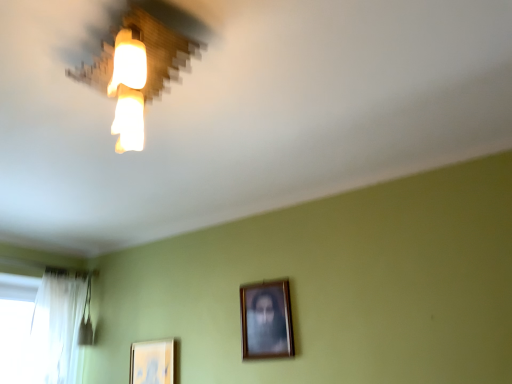
Where is `wooden framed portrait at center, the 1th picture frame when ordered from right to left`? This screenshot has height=384, width=512. wooden framed portrait at center, the 1th picture frame when ordered from right to left is located at coordinates (266, 320).

What do you see at coordinates (152, 362) in the screenshot? Image resolution: width=512 pixels, height=384 pixels. I see `matte white picture frame at lower left, placed as the second picture frame when sorted from top to bottom` at bounding box center [152, 362].

At what (x,y) coordinates should I click in order to perform the action: click on wooden framed portrait at center, the 2th picture frame positioned from the back. Please return your answer as a coordinate pair (x, y). This screenshot has height=384, width=512. Looking at the image, I should click on (266, 320).

Who is more distant, wooden framed portrait at center, the 2th picture frame viewed from the left, or white sheer curtain at left?

white sheer curtain at left is further from the camera.

Is point (280, 324) less distant than point (12, 283)?

Yes.

The image size is (512, 384). What are the coordinates of `window that is above the wooden framed portrait at center, the 2th picture frame viewed from the left (from a real-world perspective)` in the screenshot? It's located at click(42, 326).

Who is taller, white sheer curtain at left or wooden lampshade at upper left?

With more height is white sheer curtain at left.

Considering the relative positions of white sheer curtain at left and wooden lampshade at upper left in the image provided, is white sheer curtain at left in front of wooden lampshade at upper left?

No, white sheer curtain at left is further to the viewer.

Looking at this image, does white sheer curtain at left contain wooden lampshade at upper left?

No.

Is white sheer curtain at left positioned with its back to wooden lampshade at upper left?

No.

Is point (82, 318) farther from camera compared to point (290, 315)?

Yes.

From the picture: Considering the relative sizes of white sheer curtain at left and wooden framed portrait at center, the 1th picture frame when ordered from right to left, in the image provided, is white sheer curtain at left taller than wooden framed portrait at center, the 1th picture frame when ordered from right to left,?

Indeed, white sheer curtain at left has a greater height compared to wooden framed portrait at center, the 1th picture frame when ordered from right to left.

Looking at this image, visually, is white sheer curtain at left positioned to the left or to the right of wooden framed portrait at center, the first picture frame positioned from the front?

In the image, white sheer curtain at left appears on the left side of wooden framed portrait at center, the first picture frame positioned from the front.

Is matte white picture frame at lower left, which appears as the first picture frame when viewed from the back, aimed at wooden lampshade at upper left?

No, matte white picture frame at lower left, which appears as the first picture frame when viewed from the back, is not facing towards wooden lampshade at upper left.

From the image's perspective, is matte white picture frame at lower left, which is the first picture frame from left to right, located above wooden lampshade at upper left?

Incorrect, from the image's perspective, matte white picture frame at lower left, which is the first picture frame from left to right, is lower than wooden lampshade at upper left.

Considering the points (162, 353) and (175, 56), which point is behind, point (162, 353) or point (175, 56)?

Positioned behind is point (162, 353).

Is wooden framed portrait at center, which is the 2th picture frame from bottom to top, at the left side of matte white picture frame at lower left, which is the second picture frame in front-to-back order?

Result: No, wooden framed portrait at center, which is the 2th picture frame from bottom to top, is not to the left of matte white picture frame at lower left, which is the second picture frame in front-to-back order.

Who is shorter, wooden framed portrait at center, the 2th picture frame viewed from the left, or matte white picture frame at lower left, which appears as the first picture frame when viewed from the back?

Standing shorter between the two is matte white picture frame at lower left, which appears as the first picture frame when viewed from the back.

Can you confirm if wooden framed portrait at center, which is the 2th picture frame from bottom to top, is thinner than matte white picture frame at lower left, arranged as the second picture frame when viewed from the right?

Indeed, wooden framed portrait at center, which is the 2th picture frame from bottom to top, has a lesser width compared to matte white picture frame at lower left, arranged as the second picture frame when viewed from the right.

Between wooden framed portrait at center, the 2th picture frame positioned from the back, and matte white picture frame at lower left, arranged as the second picture frame when viewed from the right, which one is positioned behind?

→ matte white picture frame at lower left, arranged as the second picture frame when viewed from the right, is further from the camera.

How far apart are wooden framed portrait at center, the 1th picture frame from the top, and wooden lampshade at upper left?

wooden framed portrait at center, the 1th picture frame from the top, is 1.36 meters from wooden lampshade at upper left.

Does wooden framed portrait at center, the first picture frame positioned from the front, come behind wooden lampshade at upper left?

Yes, wooden framed portrait at center, the first picture frame positioned from the front, is further from the camera.

Is wooden framed portrait at center, the 1th picture frame from the top, outside of wooden lampshade at upper left?

wooden framed portrait at center, the 1th picture frame from the top, is positioned outside wooden lampshade at upper left.

Which of these two, wooden framed portrait at center, the 1th picture frame when ordered from right to left, or wooden lampshade at upper left, stands taller?

wooden framed portrait at center, the 1th picture frame when ordered from right to left, is taller.

Is point (162, 375) more distant than point (4, 346)?

No, it is not.

Is the depth of matte white picture frame at lower left, positioned as the 1th picture frame in bottom-to-top order, greater than that of white sheer curtain at left?

That is False.

Is matte white picture frame at lower left, which is the second picture frame in front-to-back order, next to white sheer curtain at left and touching it?

No, matte white picture frame at lower left, which is the second picture frame in front-to-back order, is not in contact with white sheer curtain at left.

Is matte white picture frame at lower left, positioned as the 1th picture frame in bottom-to-top order, shorter than white sheer curtain at left?

Yes.

Locate an element on the screen. This screenshot has width=512, height=384. window located on the left of wooden framed portrait at center, the 1th picture frame from the top is located at coordinates (42, 326).

At what (x,y) coordinates should I click in order to perform the action: click on window below the wooden lampshade at upper left (from the image's perspective). Please return your answer as a coordinate pair (x, y). This screenshot has height=384, width=512. Looking at the image, I should click on (42, 326).

Estimate the real-world distances between objects in this image. Which object is closer to wooden framed portrait at center, which is the 2th picture frame from bottom to top, wooden lampshade at upper left or matte white picture frame at lower left, positioned as the 1th picture frame in bottom-to-top order?

matte white picture frame at lower left, positioned as the 1th picture frame in bottom-to-top order.

Considering their positions, is white sheer curtain at left positioned closer to matte white picture frame at lower left, positioned as the 1th picture frame in bottom-to-top order, than wooden framed portrait at center, the 1th picture frame from the top?

Based on the image, white sheer curtain at left appears to be nearer to matte white picture frame at lower left, positioned as the 1th picture frame in bottom-to-top order.

Based on their spatial positions, is wooden lampshade at upper left or white sheer curtain at left further from matte white picture frame at lower left, which appears as the first picture frame when viewed from the back?

The object further to matte white picture frame at lower left, which appears as the first picture frame when viewed from the back, is wooden lampshade at upper left.

Looking at the image, which one is located further to wooden lampshade at upper left, matte white picture frame at lower left, which is the second picture frame in front-to-back order, or white sheer curtain at left?

white sheer curtain at left is positioned further to the anchor wooden lampshade at upper left.

Looking at the image, which one is located closer to white sheer curtain at left, matte white picture frame at lower left, arranged as the second picture frame when viewed from the right, or wooden framed portrait at center, the 1th picture frame when ordered from right to left?

Based on the image, matte white picture frame at lower left, arranged as the second picture frame when viewed from the right, appears to be nearer to white sheer curtain at left.

Considering their positions, is wooden framed portrait at center, which is the 2th picture frame from bottom to top, positioned closer to matte white picture frame at lower left, positioned as the 1th picture frame in bottom-to-top order, than wooden lampshade at upper left?

wooden framed portrait at center, which is the 2th picture frame from bottom to top, is closer to matte white picture frame at lower left, positioned as the 1th picture frame in bottom-to-top order.

In the scene shown: When comparing their distances from wooden framed portrait at center, the 1th picture frame from the top, does white sheer curtain at left or matte white picture frame at lower left, positioned as the 1th picture frame in bottom-to-top order, seem closer?

Based on the image, matte white picture frame at lower left, positioned as the 1th picture frame in bottom-to-top order, appears to be nearer to wooden framed portrait at center, the 1th picture frame from the top.

Estimate the real-world distances between objects in this image. Which object is closer to white sheer curtain at left, wooden framed portrait at center, the 2th picture frame positioned from the back, or matte white picture frame at lower left, placed as the second picture frame when sorted from top to bottom?

matte white picture frame at lower left, placed as the second picture frame when sorted from top to bottom, lies closer to white sheer curtain at left than the other object.

Locate an element on the screen. The image size is (512, 384). picture frame located between wooden lampshade at upper left and matte white picture frame at lower left, which appears as the first picture frame when viewed from the back, in the depth direction is located at coordinates (266, 320).

The width and height of the screenshot is (512, 384). I want to click on picture frame between white sheer curtain at left and wooden framed portrait at center, the 2th picture frame viewed from the left, in the horizontal direction, so tap(152, 362).